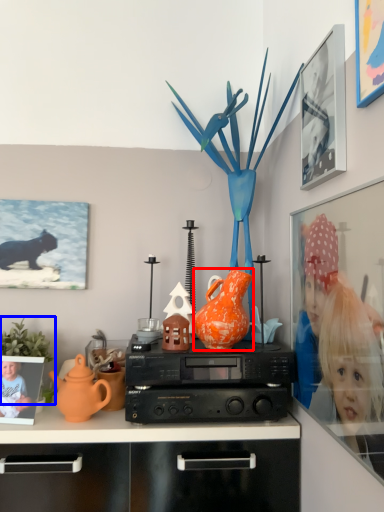
Question: Among these objects, which one is farthest to the camera, vase (highlighted by a red box) or plant (highlighted by a blue box)?

Choices:
 (A) vase
 (B) plant

Answer: (B)